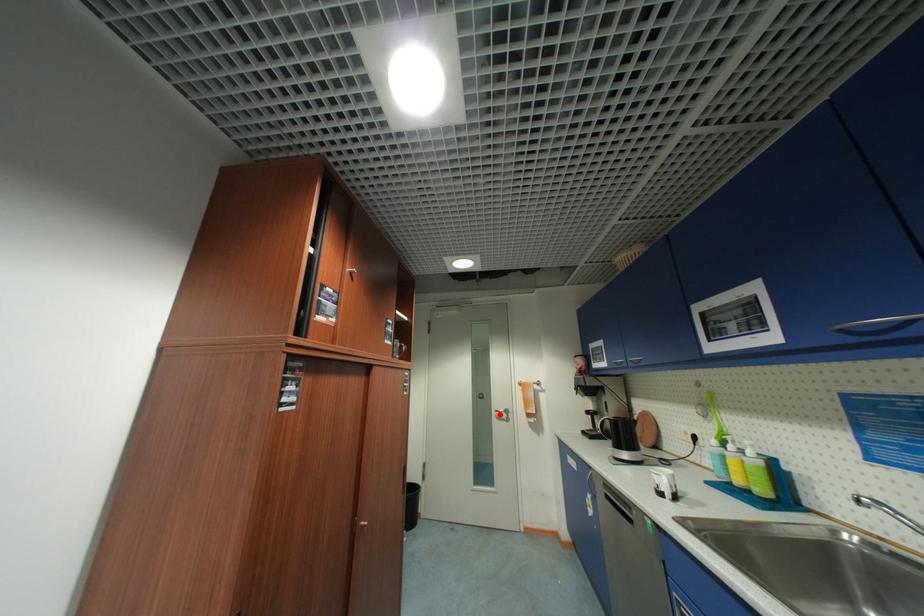
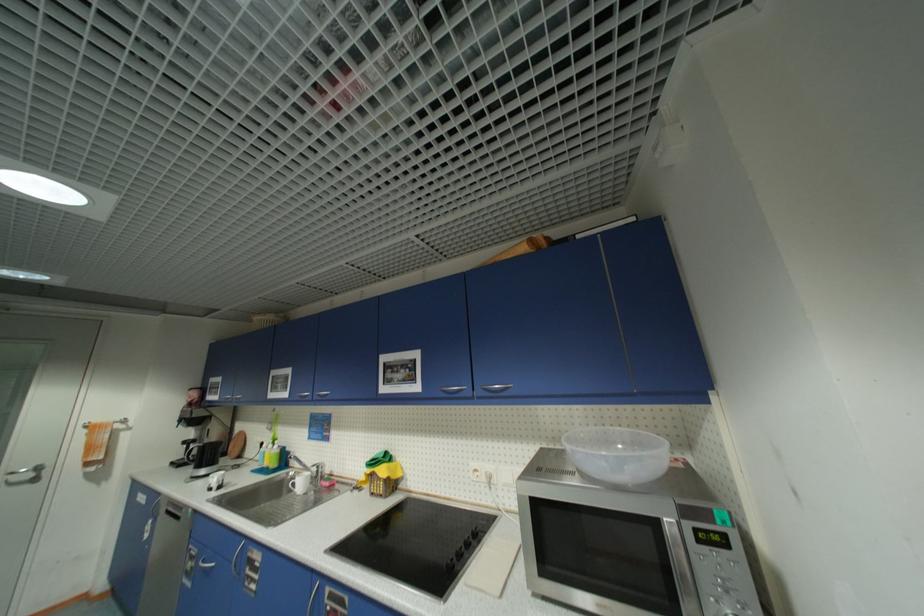
Question: I am providing you with two images of the same scene from different viewpoints. Image1 has a red point marked. In image2, the corresponding 3D location appears at what relative position? Reply with the corresponding letter.

Choices:
 (A) Closer
 (B) Farther

Answer: (A)